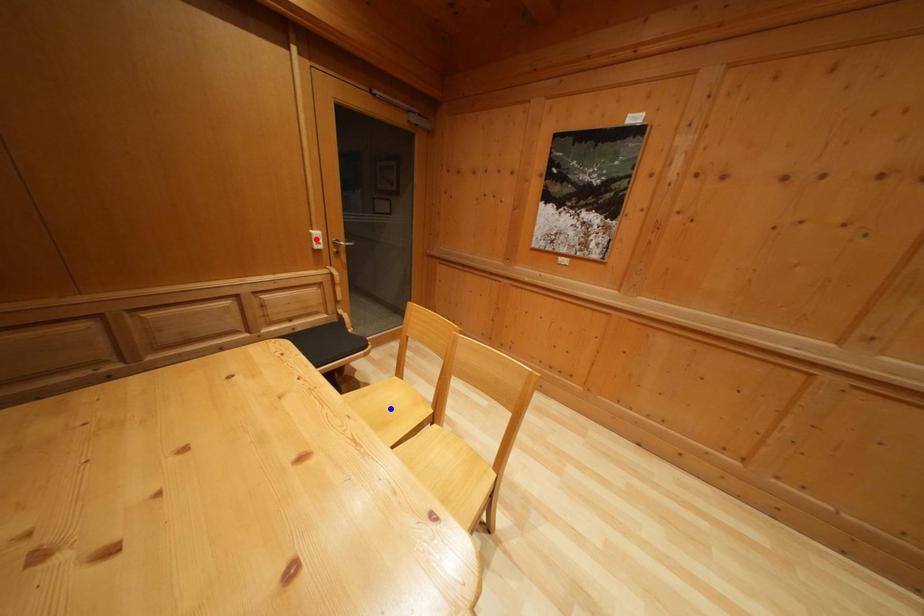
Question: Which of the two points in the image is closer to the camera?

Choices:
 (A) Blue point is closer.
 (B) Red point is closer.

Answer: (A)